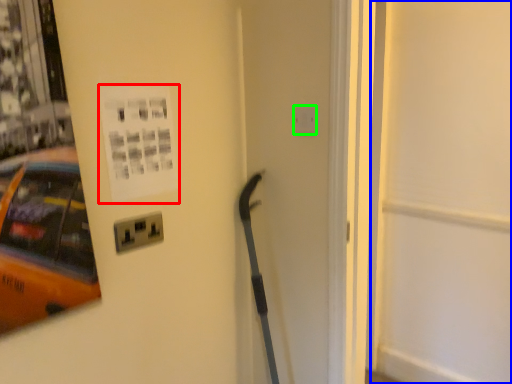
Question: Based on their relative distances, which object is nearer to poster page (highlighted by a red box)? Choose from door (highlighted by a blue box) and electric outlet (highlighted by a green box).

Choices:
 (A) door
 (B) electric outlet

Answer: (B)